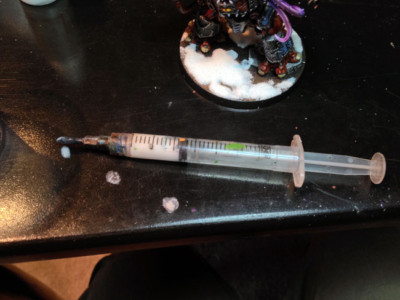
Find the location of a particular element. The width and height of the screenshot is (400, 300). plunger is located at coordinates (341, 166).